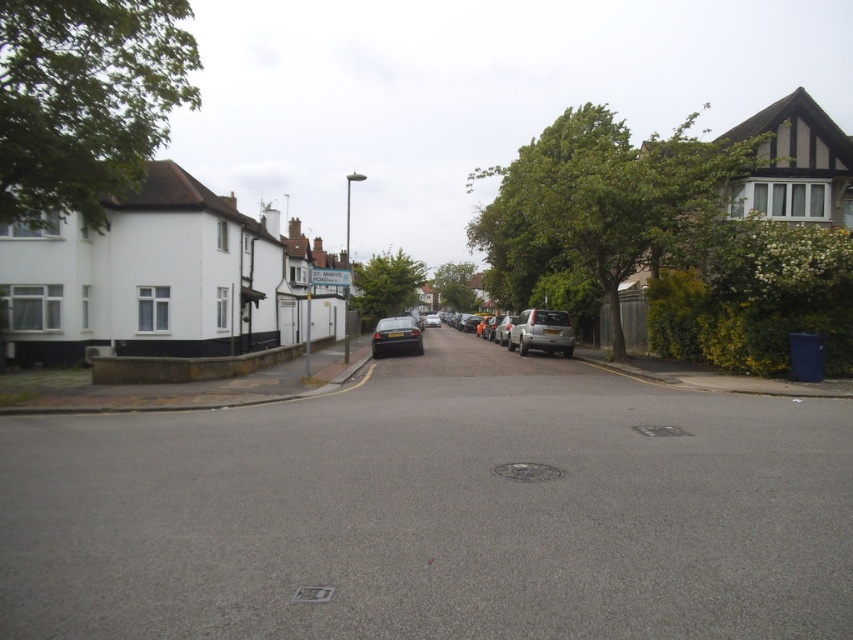
Question: Which point is farther from the camera taking this photo?

Choices:
 (A) (518, 332)
 (B) (415, 352)

Answer: (A)

Question: Can you confirm if satin silver car at center is bigger than satin black car at center?

Choices:
 (A) yes
 (B) no

Answer: (A)

Question: Can you confirm if satin silver car at center is wider than satin black car at center?

Choices:
 (A) no
 (B) yes

Answer: (A)

Question: Does satin silver car at center appear on the right side of satin black car at center?

Choices:
 (A) yes
 (B) no

Answer: (A)